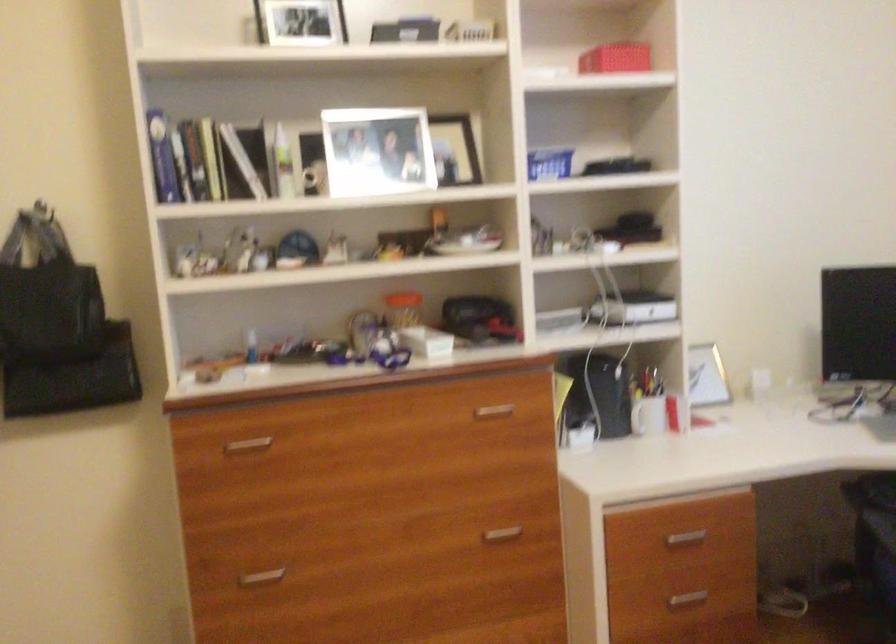
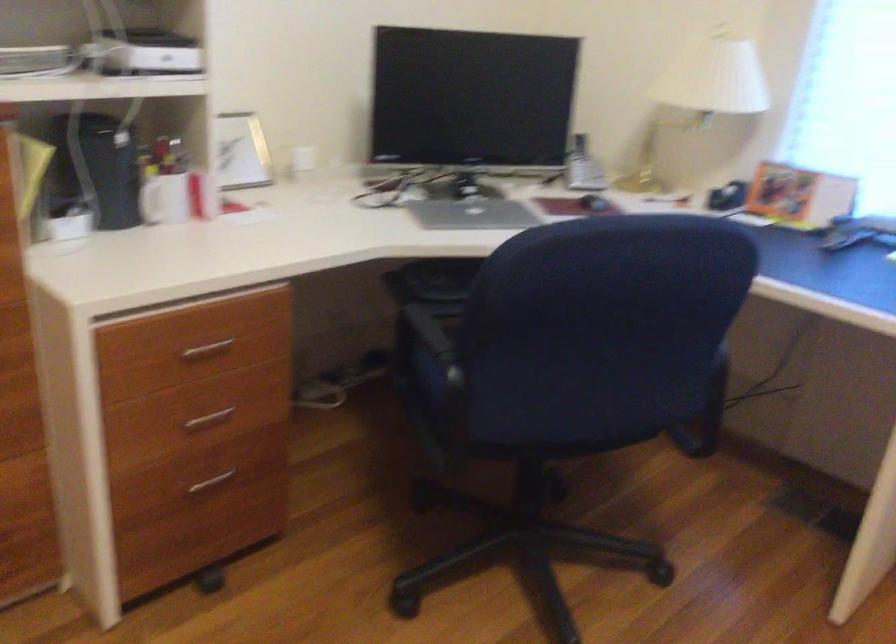
Question: Based on the continuous images, in which direction is the camera rotating? Reply with the corresponding letter.

Choices:
 (A) Left
 (B) Right
 (C) Up
 (D) Down

Answer: (B)